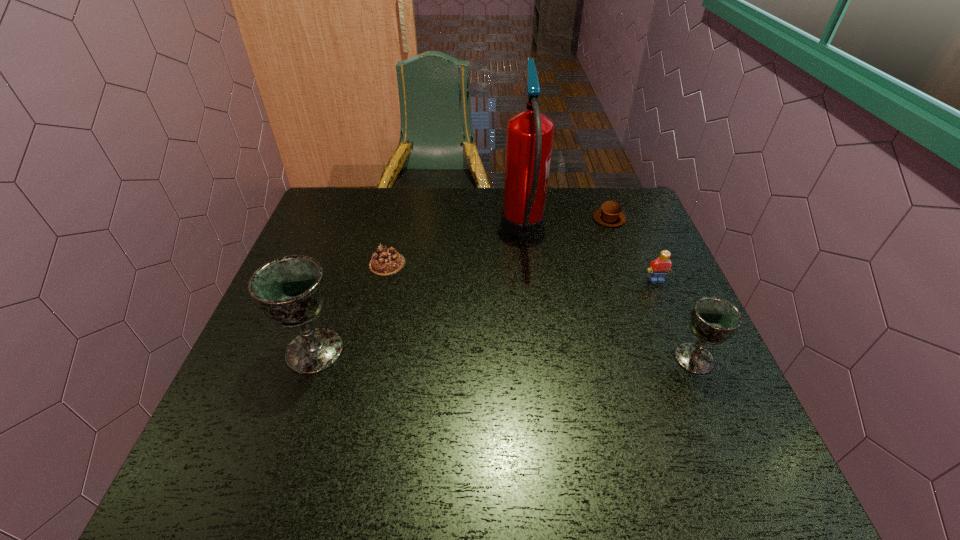
Image resolution: width=960 pixels, height=540 pixels. I want to click on free point located on the back of the taller chalice, so click(337, 286).

What are the coordinates of `vacant space located on the back of the shorter chalice` in the screenshot? It's located at (679, 322).

Where is `free location located on the left of the fire extinguisher`? free location located on the left of the fire extinguisher is located at coordinates coord(385,231).

The height and width of the screenshot is (540, 960). Identify the location of vacant space located 0.400m on the left of the fifth tallest object. [464, 219].

I want to click on vacant area situated 0.210m on the back of the chocolate cake, so click(400, 210).

Where is `vacant area located on the front-facing side of the third nearest object`? vacant area located on the front-facing side of the third nearest object is located at coordinates (714, 416).

The image size is (960, 540). Find the location of `fire extinguisher present at the far edge`. fire extinguisher present at the far edge is located at coordinates (529, 138).

Identify the location of muffin that is at the far edge. The width and height of the screenshot is (960, 540). (609, 214).

The image size is (960, 540). I want to click on object present at the left edge, so click(291, 290).

Identify the location of chalice that is at the right edge. Image resolution: width=960 pixels, height=540 pixels. (713, 320).